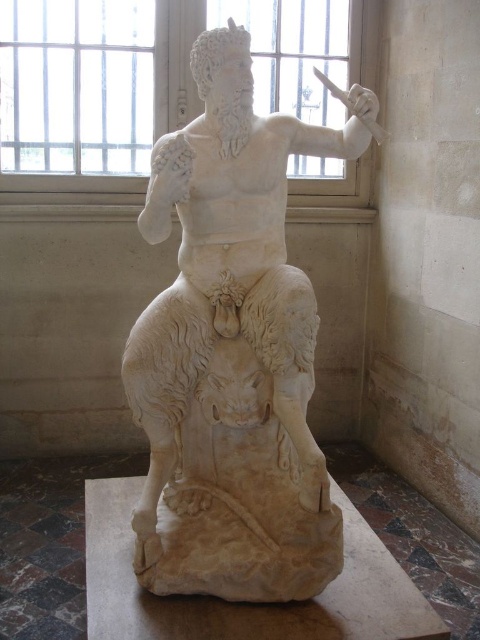
You are standing in front of the classical marble sculpture of Hercules and the lion. There are two points marked on the sculpture. One is at coordinate point (254, 452) and the other is at point (69, 131). From your perspective, which point is closer to you?

Point (254, 452) is in front of point (69, 131), so it is closer to you.

You are standing in a museum and see the white marble statue at center. If you were to draw a dot exactly where the statue is located in the image, what coordinates would you use?

The 2D location of the white marble statue at center is at point (231, 348).